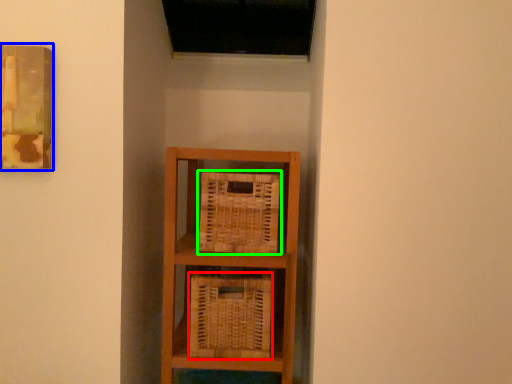
Question: Based on their relative distances, which object is nearer to basket (highlighted by a red box)? Choose from picture frame (highlighted by a blue box) and basket (highlighted by a green box).

Choices:
 (A) picture frame
 (B) basket

Answer: (B)